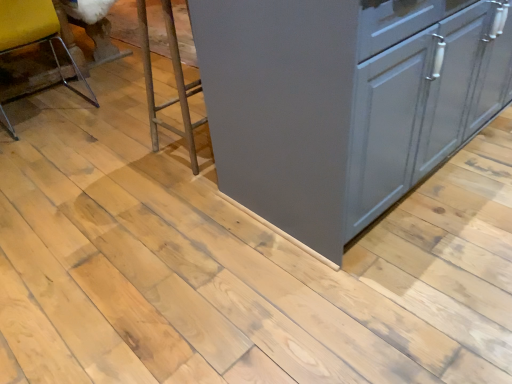
Question: Is metallic silver step stool at center in front of or behind satin gray cabinet at center in the image?

Choices:
 (A) behind
 (B) front

Answer: (A)

Question: Is metallic silver step stool at center inside or outside of satin gray cabinet at center?

Choices:
 (A) outside
 (B) inside

Answer: (A)

Question: Considering the real-world distances, which object is farthest from the clear plastic chair at left?

Choices:
 (A) metallic silver step stool at center
 (B) satin gray cabinet at center

Answer: (B)

Question: Which object is the farthest from the clear plastic chair at left?

Choices:
 (A) metallic silver step stool at center
 (B) satin gray cabinet at center

Answer: (B)